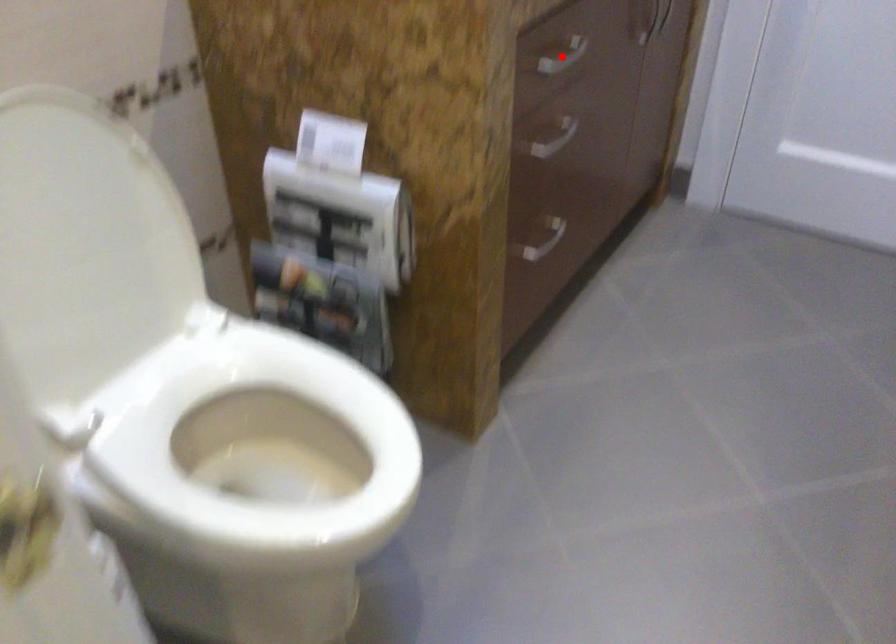
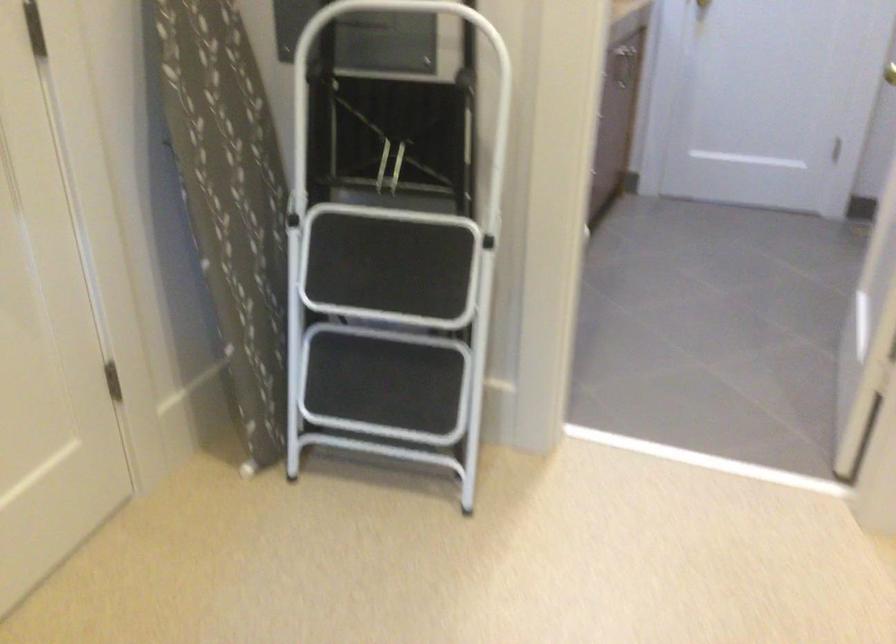
Question: I am providing you with two images of the same scene from different viewpoints. A red point is marked on the first image. At the location where the point appears in image 1, is it still visible in image 2?

Choices:
 (A) Yes
 (B) No

Answer: (B)